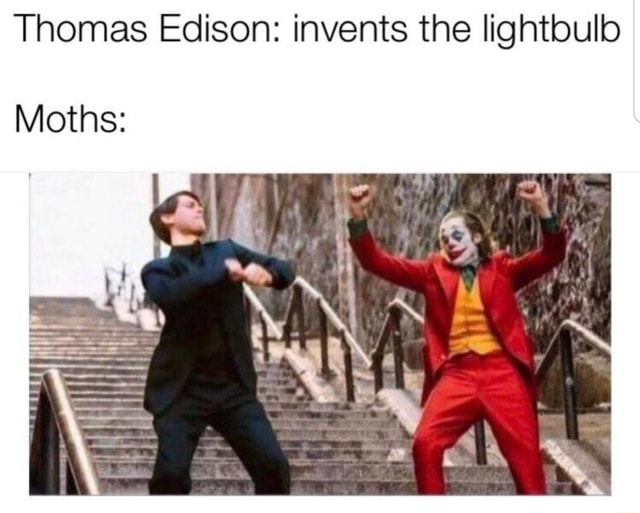
Locate an element on the screen. stairs is located at coordinates (333, 438).